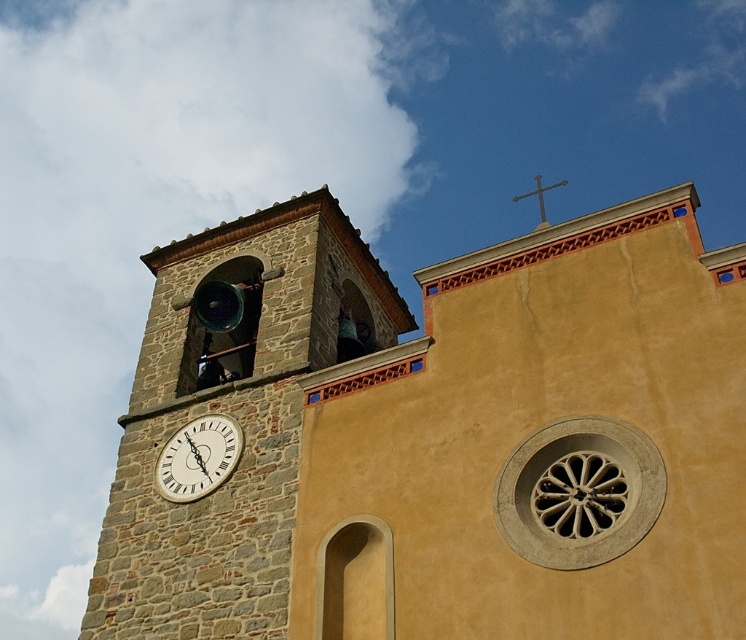
You are standing in front of the church and notice two points marked on the bell tower. The first point is at coordinates point (504, 339), and the second is at point (539, 204). Which point is nearer to you?

Point (504, 339) is closer to the viewer than point (539, 204).